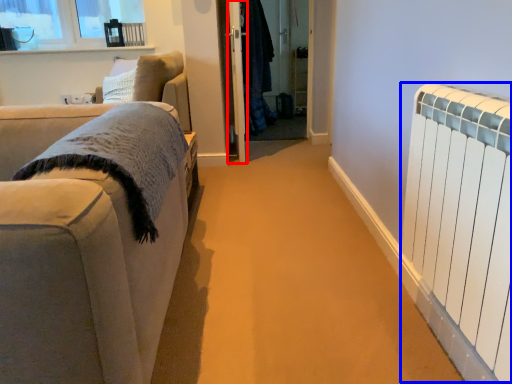
Question: Which object is further to the camera taking this photo, screen door (highlighted by a red box) or radiator (highlighted by a blue box)?

Choices:
 (A) screen door
 (B) radiator

Answer: (A)